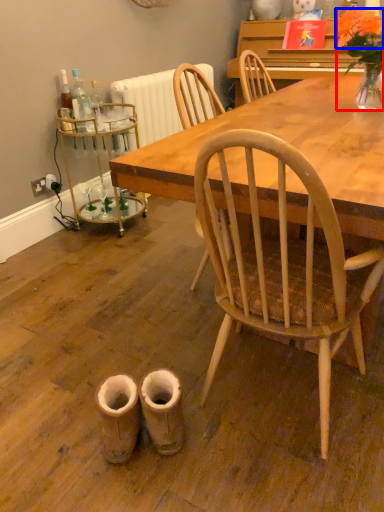
Question: Which object appears farthest to the camera in this image, houseplant (highlighted by a red box) or flower (highlighted by a blue box)?

Choices:
 (A) houseplant
 (B) flower

Answer: (B)